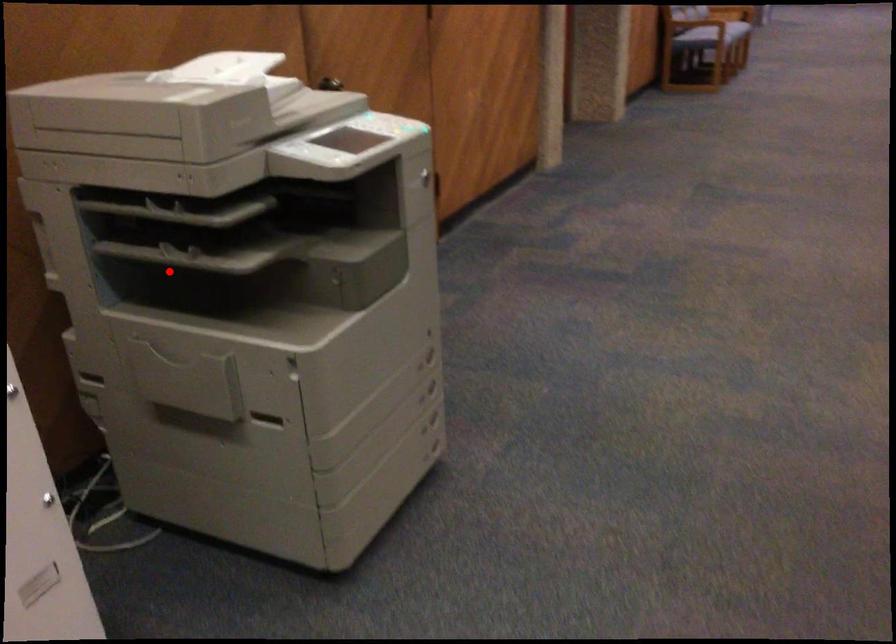
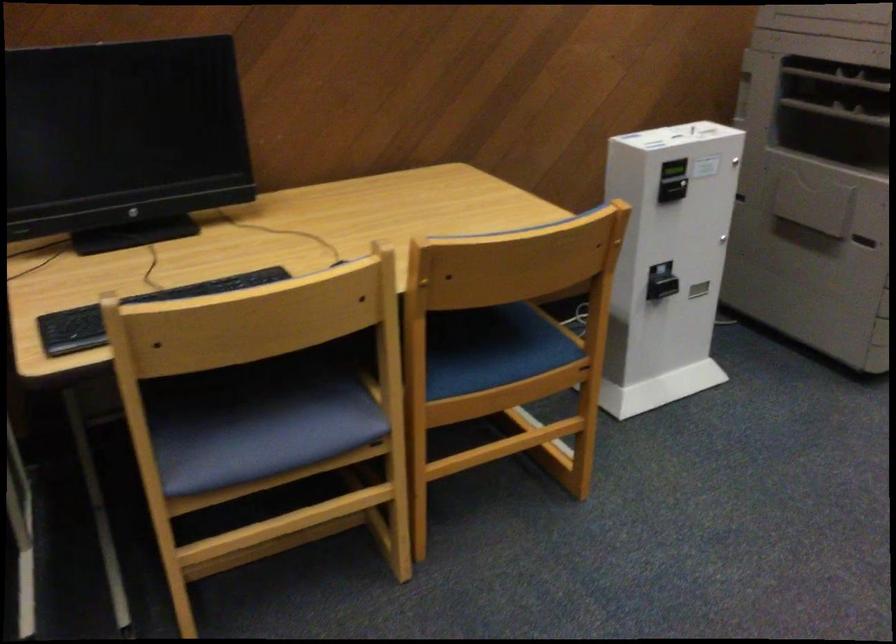
Question: I am providing you with two images of the same scene from different viewpoints. In image1, a red point is highlighted. Considering the same 3D point in image2, which of the following is correct?

Choices:
 (A) It is closer
 (B) It is farther

Answer: (B)